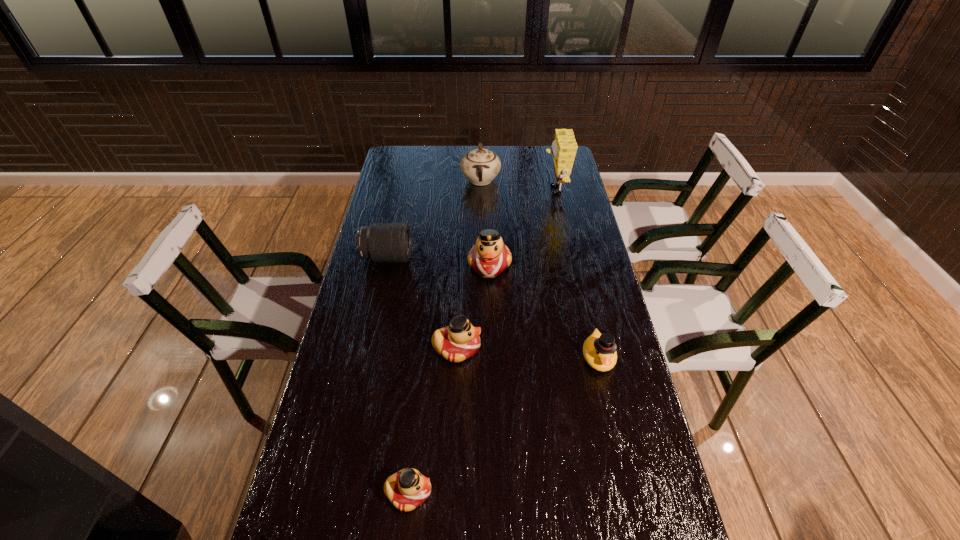
At what (x,y) coordinates should I click in order to perform the action: click on duck that is the third closest to the telephoto lens. Please return your answer as a coordinate pair (x, y). The width and height of the screenshot is (960, 540). Looking at the image, I should click on (599, 350).

I want to click on the closest red duck to the nearest red duck, so (x=460, y=340).

Identify which red duck is the third nearest to the white chinaware. Please provide its 2D coordinates. Your answer should be formatted as a tuple, i.e. [(x, y)], where the tuple contains the x and y coordinates of a point satisfying the conditions above.

[(407, 489)]